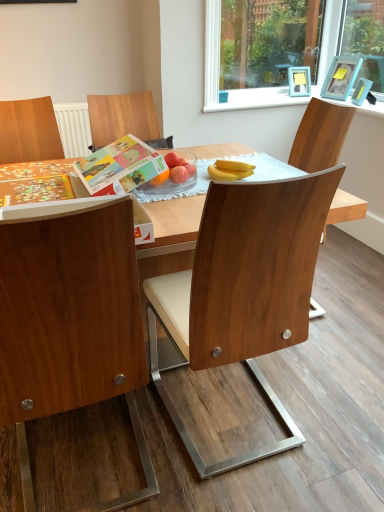
Question: Does white plastic window frame at upper right have a greater height compared to yellow matte bananas at center?

Choices:
 (A) no
 (B) yes

Answer: (B)

Question: Is white plastic window frame at upper right positioned before yellow matte bananas at center?

Choices:
 (A) yes
 (B) no

Answer: (B)

Question: Considering the relative sizes of white plastic window frame at upper right and yellow matte bananas at center in the image provided, is white plastic window frame at upper right smaller than yellow matte bananas at center?

Choices:
 (A) yes
 (B) no

Answer: (B)

Question: Is white plastic window frame at upper right next to yellow matte bananas at center and touching it?

Choices:
 (A) no
 (B) yes

Answer: (A)

Question: Considering the relative sizes of white plastic window frame at upper right and yellow matte bananas at center in the image provided, is white plastic window frame at upper right thinner than yellow matte bananas at center?

Choices:
 (A) no
 (B) yes

Answer: (B)

Question: Considering the positions of wooden chair at left, marked as the first chair in a left-to-right arrangement, and wooden chair at center, the 1th chair positioned from the right, in the image, is wooden chair at left, marked as the first chair in a left-to-right arrangement, wider or thinner than wooden chair at center, the 1th chair positioned from the right,?

Choices:
 (A) wide
 (B) thin

Answer: (A)

Question: From the image's perspective, is wooden chair at left, marked as the first chair in a left-to-right arrangement, located above or below wooden chair at center, the 1th chair positioned from the right?

Choices:
 (A) above
 (B) below

Answer: (B)

Question: From a real-world perspective, is wooden chair at left, marked as the first chair in a left-to-right arrangement, above or below wooden chair at center, the 1th chair positioned from the right?

Choices:
 (A) below
 (B) above

Answer: (B)

Question: Considering the positions of wooden chair at left, placed as the 2th chair when sorted from right to left, and wooden chair at center, the 1th chair positioned from the right, in the image, is wooden chair at left, placed as the 2th chair when sorted from right to left, taller or shorter than wooden chair at center, the 1th chair positioned from the right,?

Choices:
 (A) tall
 (B) short

Answer: (A)

Question: Is blue plastic picture frame at upper right, arranged as the first picture frame when ordered from the bottom, taller or shorter than white plastic window frame at upper right?

Choices:
 (A) short
 (B) tall

Answer: (A)

Question: From the image's perspective, is blue plastic picture frame at upper right, the second picture frame positioned from the top, positioned above or below white plastic window frame at upper right?

Choices:
 (A) above
 (B) below

Answer: (B)

Question: From a real-world perspective, is blue plastic picture frame at upper right, arranged as the first picture frame when ordered from the bottom, physically located above or below white plastic window frame at upper right?

Choices:
 (A) below
 (B) above

Answer: (A)

Question: Is point (354, 95) positioned closer to the camera than point (208, 105)?

Choices:
 (A) farther
 (B) closer

Answer: (B)

Question: From the image's perspective, is matte paper book at center positioned above or below white plastic window frame at upper right?

Choices:
 (A) below
 (B) above

Answer: (A)

Question: Looking at their shapes, would you say matte paper book at center is wider or thinner than white plastic window frame at upper right?

Choices:
 (A) thin
 (B) wide

Answer: (B)